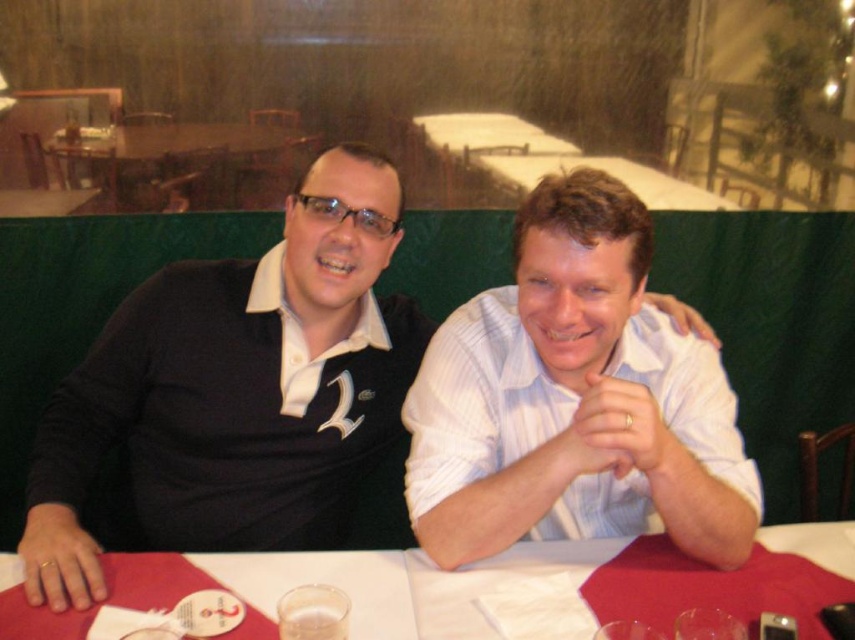
Which of these two, white matte hand at center or white paper at upper center, stands shorter?

white paper at upper center is shorter.

Can you confirm if white matte hand at center is positioned to the left of white paper at upper center?

Correct, you'll find white matte hand at center to the left of white paper at upper center.

Which is in front, point (620, 401) or point (711, 195)?

Point (620, 401) is more forward.

Where is `white matte hand at center`? white matte hand at center is located at coordinates (623, 426).

Which of these two, wooden round table at upper center or white matte hand at upper center, stands taller?

With more height is wooden round table at upper center.

Looking at this image, can you confirm if wooden round table at upper center is thinner than white matte hand at upper center?

No, wooden round table at upper center is not thinner than white matte hand at upper center.

The width and height of the screenshot is (855, 640). Find the location of `wooden round table at upper center`. wooden round table at upper center is located at coordinates (175, 145).

What are the coordinates of `wooden round table at upper center` in the screenshot? It's located at [x=175, y=145].

Who is taller, black matte shirt at center or white paper at upper center?

black matte shirt at center is taller.

Is point (42, 465) positioned after point (640, 163)?

No, (42, 465) is closer to viewer.

Find the location of a particular element. The image size is (855, 640). black matte shirt at center is located at coordinates (249, 378).